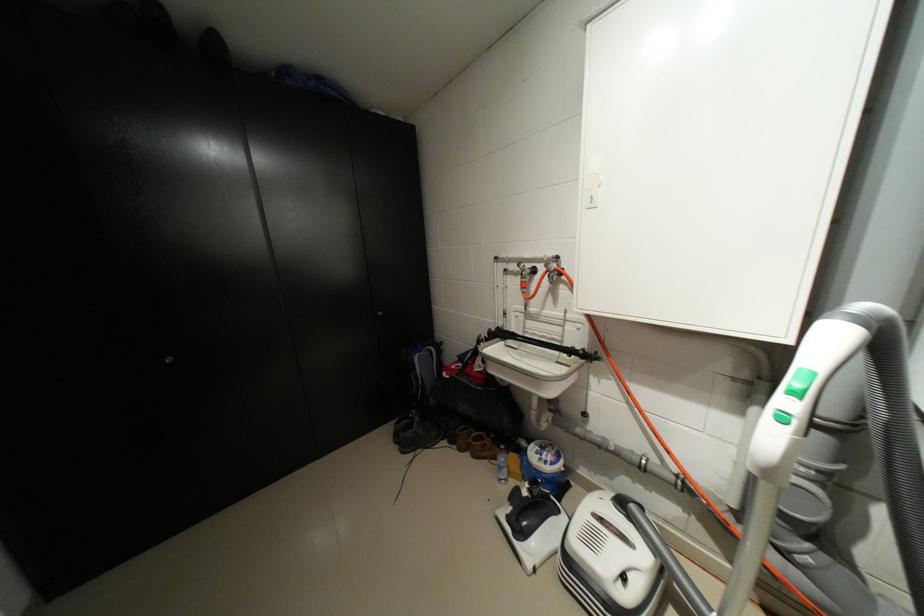
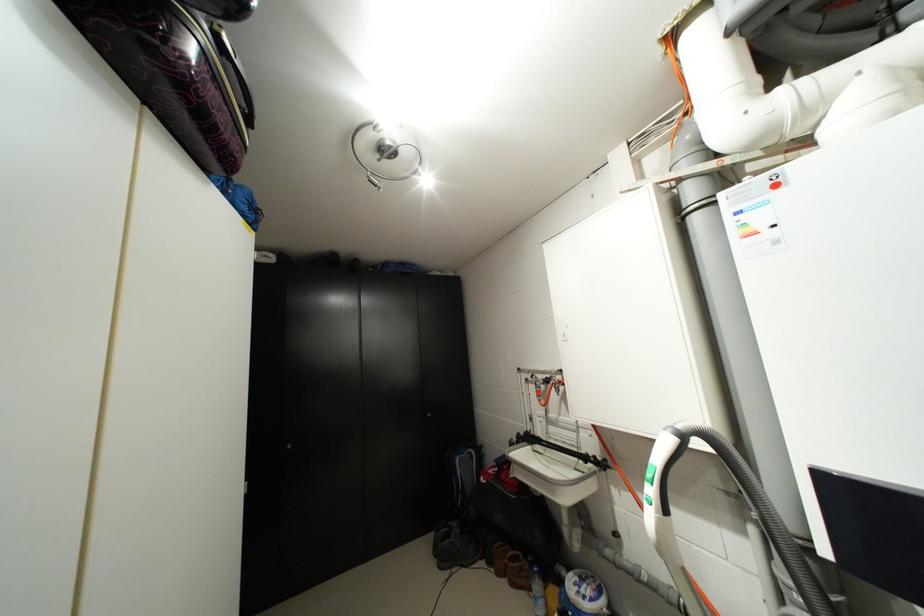
The point at (435, 444) is marked in the first image. Where is the corresponding point in the second image?

(473, 562)